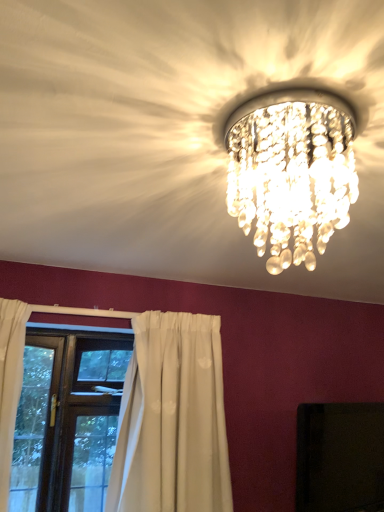
In order to face clear crystal chandelier at upper center, should I rotate leftwards or rightwards?

To face it directly, rotate right by 12.829 degrees.

Identify the location of brown wooden window at lower left. (67, 418).

Which object is wider, brown wooden window at lower left or clear crystal chandelier at upper center?

clear crystal chandelier at upper center.

Is brown wooden window at lower left positioned with its back to clear crystal chandelier at upper center?

brown wooden window at lower left does not have its back to clear crystal chandelier at upper center.

Identify the location of window located on the left of clear crystal chandelier at upper center. (67, 418).

Can you see brown wooden window at lower left touching clear crystal chandelier at upper center?

No, brown wooden window at lower left is not with clear crystal chandelier at upper center.

How much distance is there between clear crystal chandelier at upper center and brown wooden window at lower left?

clear crystal chandelier at upper center is 1.40 meters away from brown wooden window at lower left.

Is clear crystal chandelier at upper center shorter than brown wooden window at lower left?

Yes, clear crystal chandelier at upper center is shorter than brown wooden window at lower left.

From a real-world perspective, is clear crystal chandelier at upper center physically located above or below brown wooden window at lower left?

clear crystal chandelier at upper center is situated higher than brown wooden window at lower left in the real world.

Considering the relative sizes of clear crystal chandelier at upper center and brown wooden window at lower left in the image provided, is clear crystal chandelier at upper center wider than brown wooden window at lower left?

Yes.

Consider the image. Is brown wooden window at lower left at the back of black glossy tv at upper center?

black glossy tv at upper center is not turned away from brown wooden window at lower left.

Considering their positions, is black glossy tv at upper center located in front of or behind brown wooden window at lower left?

Visually, black glossy tv at upper center is located in front of brown wooden window at lower left.

Considering the relative sizes of black glossy tv at upper center and brown wooden window at lower left in the image provided, is black glossy tv at upper center wider than brown wooden window at lower left?

No.

From a real-world perspective, does black glossy tv at upper center sit lower than brown wooden window at lower left?

Indeed, from a real-world perspective, black glossy tv at upper center is positioned beneath brown wooden window at lower left.

Considering the sizes of objects brown wooden window at lower left and black glossy tv at upper center in the image provided, who is thinner, brown wooden window at lower left or black glossy tv at upper center?

Thinner between the two is black glossy tv at upper center.

Between brown wooden window at lower left and black glossy tv at upper center, which one has more height?

brown wooden window at lower left.

From the picture: Is brown wooden window at lower left far away from black glossy tv at upper center?

Absolutely, brown wooden window at lower left is distant from black glossy tv at upper center.

Can you confirm if black glossy tv at upper center is taller than clear crystal chandelier at upper center?

Indeed, black glossy tv at upper center has a greater height compared to clear crystal chandelier at upper center.

From the image's perspective, between black glossy tv at upper center and clear crystal chandelier at upper center, who is located below?

From the image's view, black glossy tv at upper center is below.

Can clear crystal chandelier at upper center be found inside black glossy tv at upper center?

No, clear crystal chandelier at upper center is not inside black glossy tv at upper center.

Where is `dark located on the right of clear crystal chandelier at upper center`? This screenshot has height=512, width=384. dark located on the right of clear crystal chandelier at upper center is located at coordinates (340, 457).

Considering the relative sizes of clear crystal chandelier at upper center and black glossy tv at upper center in the image provided, is clear crystal chandelier at upper center taller than black glossy tv at upper center?

In fact, clear crystal chandelier at upper center may be shorter than black glossy tv at upper center.

From the image's perspective, which object appears higher, clear crystal chandelier at upper center or black glossy tv at upper center?

clear crystal chandelier at upper center is shown above in the image.

Identify the location of window that is on the left side of clear crystal chandelier at upper center. (67, 418).

I want to click on window below the clear crystal chandelier at upper center (from the image's perspective), so click(67, 418).

Based on their spatial positions, is black glossy tv at upper center or brown wooden window at lower left closer to clear crystal chandelier at upper center?

The object closer to clear crystal chandelier at upper center is black glossy tv at upper center.

Based on their spatial positions, is clear crystal chandelier at upper center or brown wooden window at lower left closer to black glossy tv at upper center?

The object closer to black glossy tv at upper center is brown wooden window at lower left.

Based on their spatial positions, is brown wooden window at lower left or black glossy tv at upper center further from clear crystal chandelier at upper center?

brown wooden window at lower left lies further to clear crystal chandelier at upper center than the other object.

Based on their spatial positions, is brown wooden window at lower left or clear crystal chandelier at upper center further from black glossy tv at upper center?

clear crystal chandelier at upper center lies further to black glossy tv at upper center than the other object.

Considering their positions, is black glossy tv at upper center positioned closer to brown wooden window at lower left than clear crystal chandelier at upper center?

The object closer to brown wooden window at lower left is black glossy tv at upper center.

Based on their spatial positions, is clear crystal chandelier at upper center or black glossy tv at upper center further from brown wooden window at lower left?

clear crystal chandelier at upper center is further to brown wooden window at lower left.

Locate an element on the screen. The height and width of the screenshot is (512, 384). lamp situated between brown wooden window at lower left and black glossy tv at upper center from left to right is located at coordinates (291, 170).